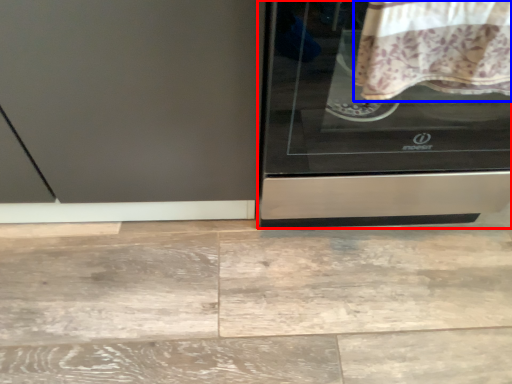
Question: Which object is further to the camera taking this photo, home appliance (highlighted by a red box) or blanket (highlighted by a blue box)?

Choices:
 (A) home appliance
 (B) blanket

Answer: (A)